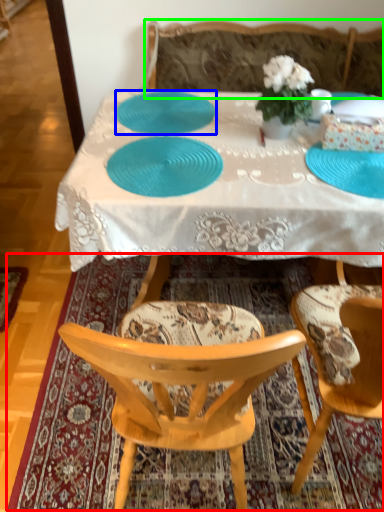
Question: Considering the real-world distances, which object is closest to mat (highlighted by a red box)? plate (highlighted by a blue box) or studio couch (highlighted by a green box).

Choices:
 (A) plate
 (B) studio couch

Answer: (A)